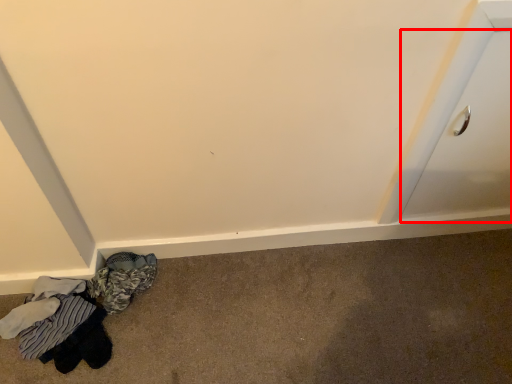
Question: Considering the relative positions of drawer (annotated by the red box) and laundry in the image provided, where is drawer (annotated by the red box) located with respect to the staircase?

Choices:
 (A) left
 (B) right

Answer: (B)